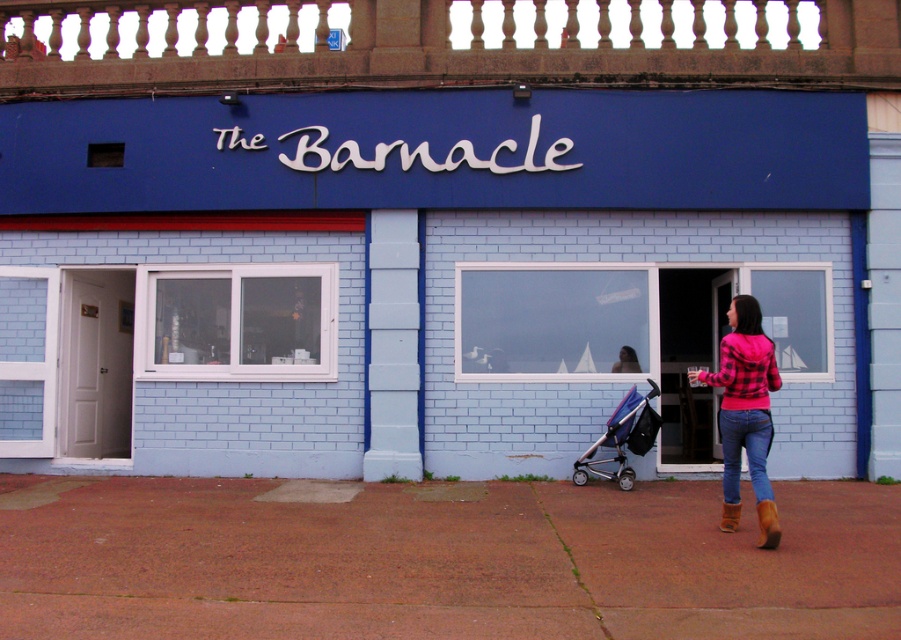
Can you confirm if metallic blue stroller at center is thinner than blue denim jeans at lower right?

Incorrect, metallic blue stroller at center's width is not less than blue denim jeans at lower right's.

Can you confirm if metallic blue stroller at center is positioned above blue denim jeans at lower right?

No, metallic blue stroller at center is not above blue denim jeans at lower right.

Is point (608, 422) positioned in front of point (745, 426)?

No, it is behind (745, 426).

In order to click on metallic blue stroller at center in this screenshot , I will do tap(622, 438).

Can you confirm if blue denim jeans at lower right is positioned above brown leather boot at lower right?

Correct, blue denim jeans at lower right is located above brown leather boot at lower right.

How much distance is there between blue denim jeans at lower right and brown leather boot at lower right?

The distance of blue denim jeans at lower right from brown leather boot at lower right is 11.65 inches.

Identify the location of blue denim jeans at lower right. The image size is (901, 640). (745, 451).

Locate an element on the screen. Image resolution: width=901 pixels, height=640 pixels. blue denim jeans at lower right is located at coordinates (745, 451).

Which is more to the left, pink plaid sweater at lower right or brown suede boot at lower right?

brown suede boot at lower right

Does pink plaid sweater at lower right have a lesser width compared to brown suede boot at lower right?

Incorrect, pink plaid sweater at lower right's width is not less than brown suede boot at lower right's.

You are a GUI agent. You are given a task and a screenshot of the screen. Output one action in this format:
    pyautogui.click(x=<x>, y=<y>)
    Task: Click on the pink plaid sweater at lower right
    This screenshot has width=901, height=640.
    Given the screenshot: What is the action you would take?
    pyautogui.click(x=745, y=408)

Identify the location of pink plaid sweater at lower right. (745, 408).